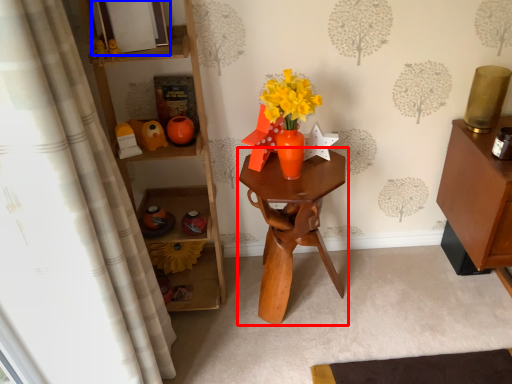
Question: Which object is further to the camera taking this photo, table (highlighted by a red box) or picture frame (highlighted by a blue box)?

Choices:
 (A) table
 (B) picture frame

Answer: (A)